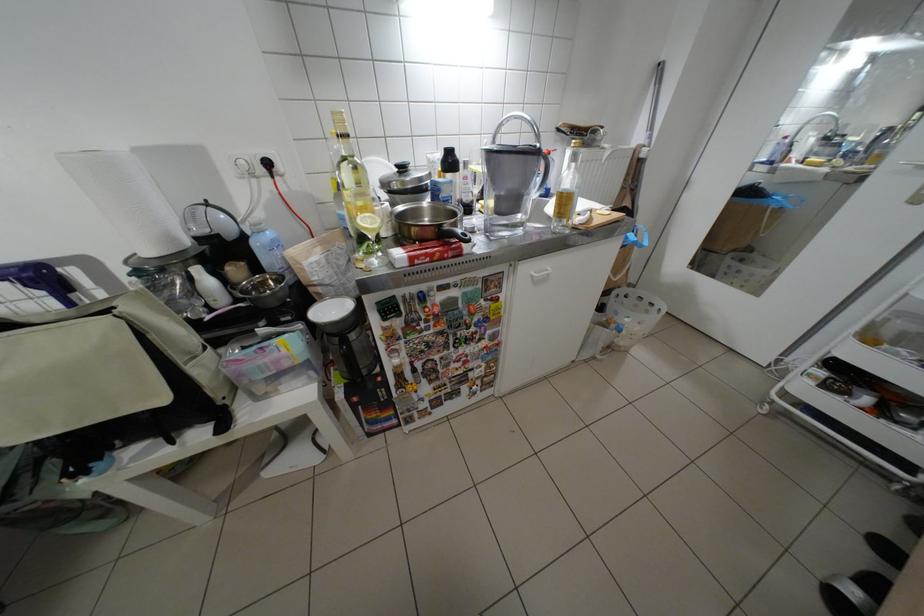
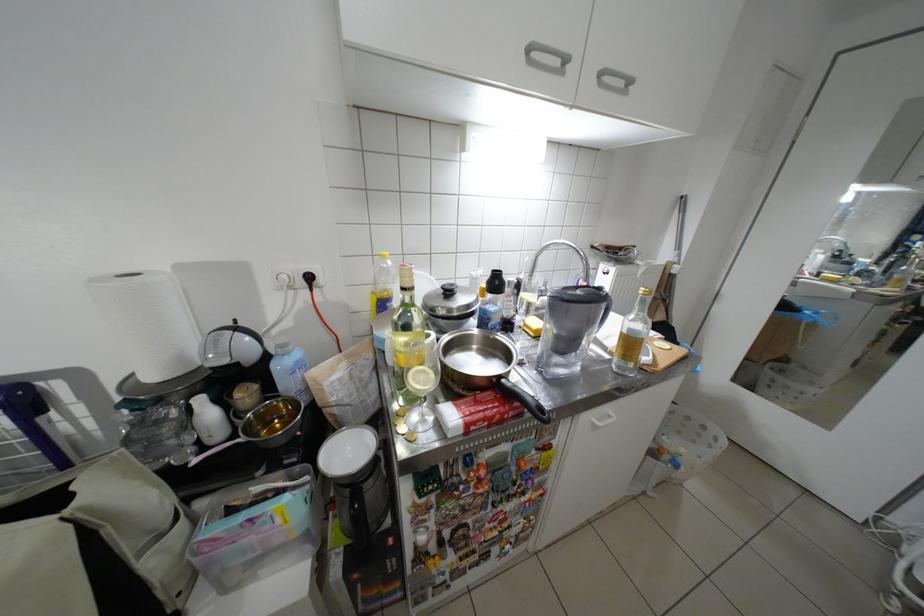
Where in the second image is the point corresponding to [343,312] from the first image?

(359, 452)